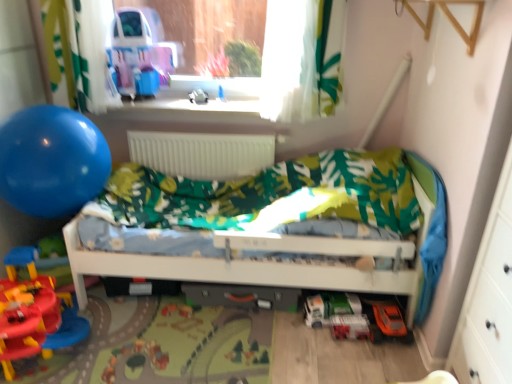
Question: In terms of height, does blue rubber balloon at left look taller or shorter compared to orange matte toy car at lower right, the 4th toy viewed from the back?

Choices:
 (A) short
 (B) tall

Answer: (B)

Question: Based on their positions, is blue rubber balloon at left located to the left or right of orange matte toy car at lower right, the 4th toy viewed from the back?

Choices:
 (A) left
 (B) right

Answer: (A)

Question: Estimate the real-world distances between objects in this image. Which object is farther from the blue rubber balloon at left?

Choices:
 (A) green matte toy car at lower center, the 4th toy in the front-to-back sequence
 (B) rubberized plastic playset at lower left, the second toy when ordered from top to bottom
 (C) white plastic toy at center, which is counted as the 4th toy, starting from the right
 (D) white matte radiator at center
 (E) white matte infant bed at center

Answer: (A)

Question: Which is nearer to the rubberized plastic playset at lower left, marked as the first toy in a left-to-right arrangement?

Choices:
 (A) clear plastic window sill at upper center
 (B) orange matte toy car at lower right, which is the second toy from bottom to top
 (C) green matte toy car at lower center, the 4th toy in the front-to-back sequence
 (D) translucent plastic toy car at lower right, the third toy from the back
 (E) shiny plastic toy car at upper left

Answer: (C)